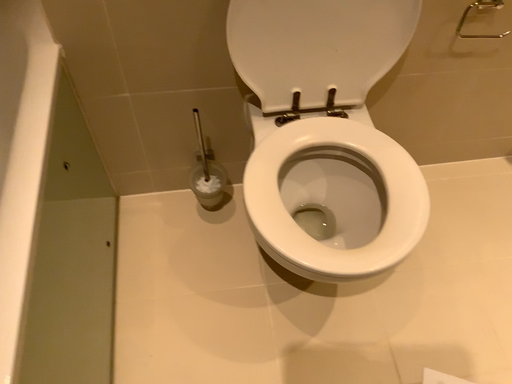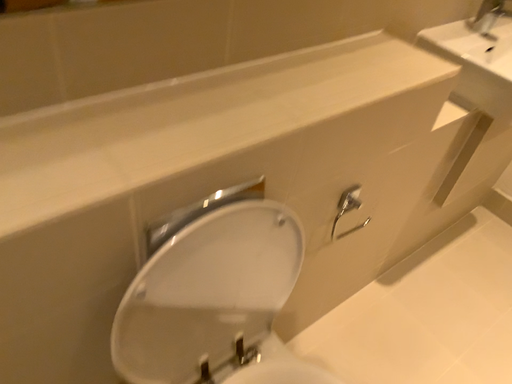
Question: Which way did the camera rotate in the video?

Choices:
 (A) rotated right
 (B) rotated left

Answer: (A)